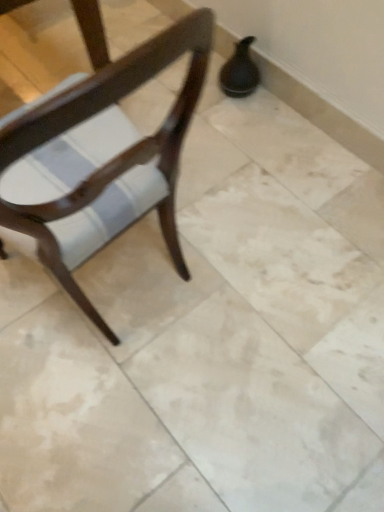
The width and height of the screenshot is (384, 512). I want to click on wooden chair at center, so click(x=99, y=152).

Describe the element at coordinates (99, 152) in the screenshot. I see `wooden chair at center` at that location.

In order to face wooden chair at center, should I rotate leftwards or rightwards?

Turn left approximately 17.448 degrees to face it.

Find the location of a particular element. This screenshot has height=512, width=384. wooden chair at center is located at coordinates (99, 152).